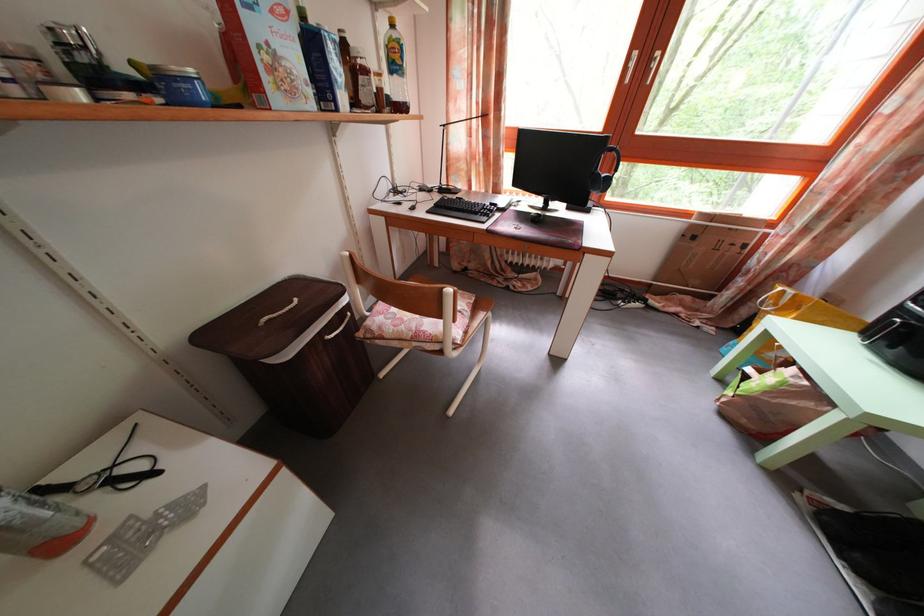
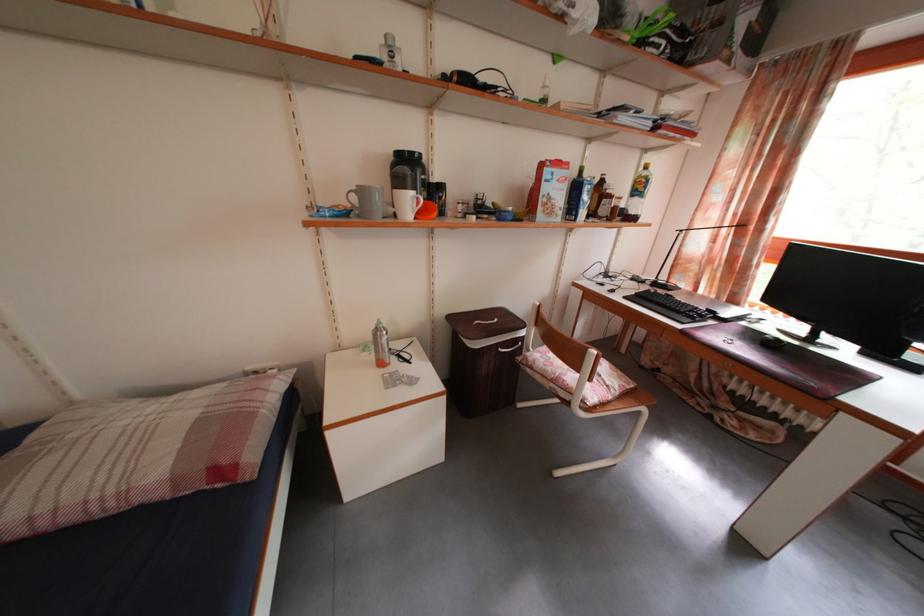
Find the pixel in the second image that matches [302,307] in the first image.

(504, 326)